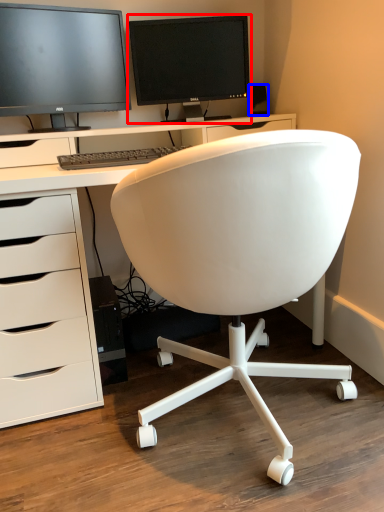
Question: Which point is further to the camera, computer monitor (highlighted by a red box) or office supplies (highlighted by a blue box)?

Choices:
 (A) computer monitor
 (B) office supplies

Answer: (B)